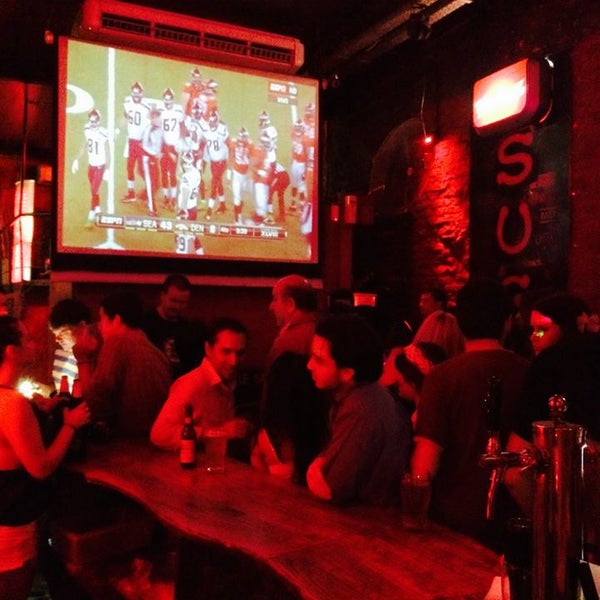
Locate an element on the screen. bottle is located at coordinates point(195,454), point(57,395), point(73,388).